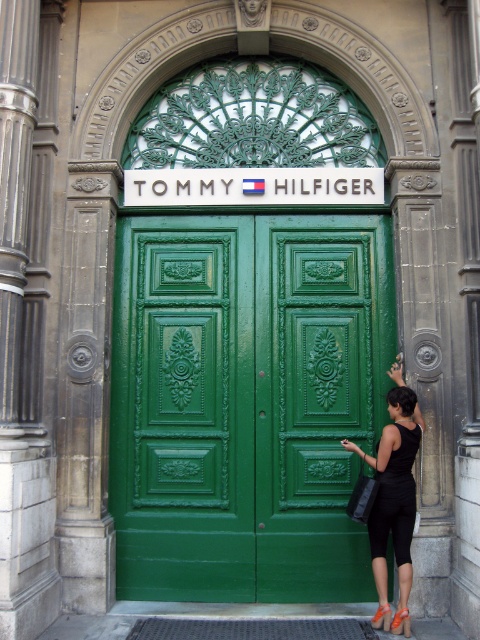
You are standing in front of the Tommy Hilfiger store entrance shown in the image. You need to enter the store but are unsure if you can reach the door handle. The door handle is at the same height as the top edge of the green polished wood door at center. Your hand can reach up to 7 feet. Is the door handle within your reach?

The green polished wood door at center is 25.08 feet away from the camera. Since the door handle is at the same height as the top edge of the door, and your hand can reach up to 7 feet, the door handle is within your reach because 25.08 feet is the distance from the camera to the door, not the height. The height of the door handle would depend on the door height, which isn not provided, so we can assume standard door heights are around 7 feet or less. Thus, the handle is reachable.

You are a window dresser preparing to hang a new banner that requires a support point. The banner is 1.8 meters tall. You see the dark gray stone column at center and the black fabric dress at lower right. Which object can provide a taller support point for the banner?

The black fabric dress at lower right is taller than the dark gray stone column at center, so it can provide a taller support point for the banner.

You are a customer entering the Tommy Hilfiger store and see the dark gray stone column at center and the black fabric dress at lower right. Which object is positioned to the right side of the store entrance?

The black fabric dress at lower right is positioned to the right side of the store entrance because it is to the right of the dark gray stone column at center.